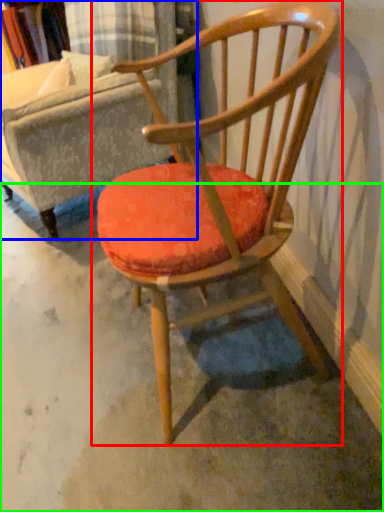
Question: Which is farther away from chair (highlighted by a red box)? swivel chair (highlighted by a blue box) or concrete (highlighted by a green box)?

Choices:
 (A) swivel chair
 (B) concrete

Answer: (A)